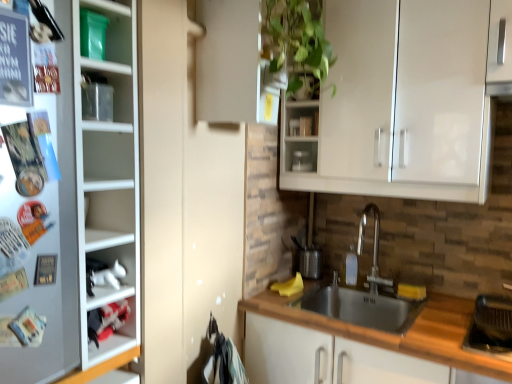
Question: Does white plastic cabinet at lower left, acting as the 2th cabinet starting from the top, contain polished stainless steel faucet at center?

Choices:
 (A) no
 (B) yes

Answer: (A)

Question: Does white plastic cabinet at lower left, acting as the 2th cabinet starting from the top, have a lesser height compared to polished stainless steel faucet at center?

Choices:
 (A) yes
 (B) no

Answer: (A)

Question: Can you confirm if white plastic cabinet at lower left, acting as the 2th cabinet starting from the top, is taller than polished stainless steel faucet at center?

Choices:
 (A) yes
 (B) no

Answer: (B)

Question: Is white plastic cabinet at lower left, arranged as the 1th cabinet when ordered from the bottom, to the left of polished stainless steel faucet at center from the viewer's perspective?

Choices:
 (A) yes
 (B) no

Answer: (A)

Question: Is white plastic cabinet at lower left, acting as the 2th cabinet starting from the top, bigger than polished stainless steel faucet at center?

Choices:
 (A) yes
 (B) no

Answer: (B)

Question: Is metallic silver cupboard at left to the left or to the right of metallic silver container at upper center in the image?

Choices:
 (A) right
 (B) left

Answer: (B)

Question: From the image's perspective, is metallic silver cupboard at left above or below metallic silver container at upper center?

Choices:
 (A) above
 (B) below

Answer: (B)

Question: Does point (19, 215) appear closer or farther from the camera than point (297, 165)?

Choices:
 (A) farther
 (B) closer

Answer: (B)

Question: Is metallic silver cupboard at left taller or shorter than metallic silver container at upper center?

Choices:
 (A) tall
 (B) short

Answer: (A)

Question: From the image's perspective, is polished stainless steel faucet at center positioned above or below white glossy cabinet at lower left, the 2th cabinet positioned from the bottom?

Choices:
 (A) below
 (B) above

Answer: (A)

Question: From a real-world perspective, relative to white glossy cabinet at lower left, the 2th cabinet positioned from the bottom, is polished stainless steel faucet at center vertically above or below?

Choices:
 (A) below
 (B) above

Answer: (A)

Question: Considering the positions of point (375, 286) and point (98, 284), is point (375, 286) closer or farther from the camera than point (98, 284)?

Choices:
 (A) closer
 (B) farther

Answer: (B)

Question: Looking at their shapes, would you say polished stainless steel faucet at center is wider or thinner than white glossy cabinet at lower left, the 2th cabinet positioned from the bottom?

Choices:
 (A) thin
 (B) wide

Answer: (B)

Question: From their relative heights in the image, would you say stainless steel sink at lower center is taller or shorter than green matte plant at upper center?

Choices:
 (A) short
 (B) tall

Answer: (B)

Question: Is stainless steel sink at lower center in front of or behind green matte plant at upper center in the image?

Choices:
 (A) front
 (B) behind

Answer: (A)